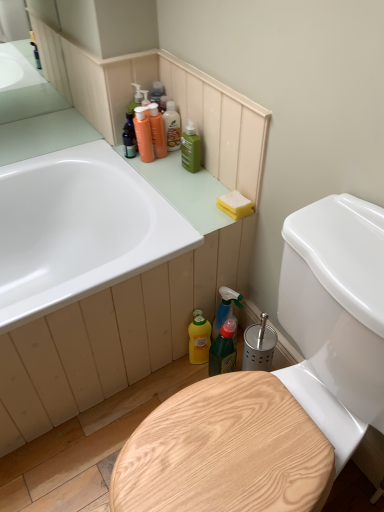
Locate an element on the screen. Image resolution: width=384 pixels, height=512 pixels. free space between matte orange bottles at upper left, marked as the 4th cleaning product in a bottom-to-top arrangement, and green matte bottle at upper center, which is the third cleaning product from bottom to top is located at coordinates (172, 161).